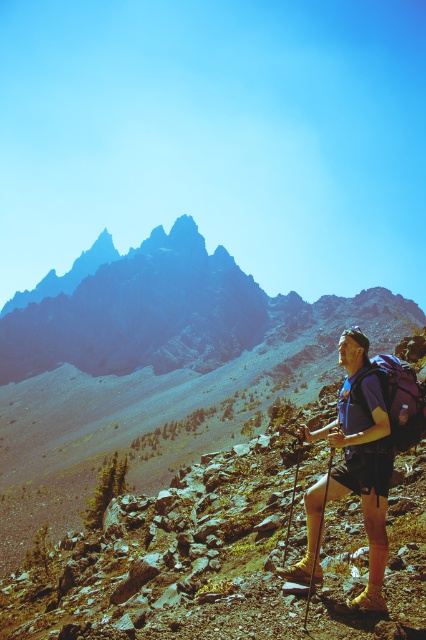
Question: Which point is closer to the camera?

Choices:
 (A) (350, 360)
 (B) (356, 397)

Answer: (B)

Question: Which object is positioned farthest from the purple matte backpack at center-right?

Choices:
 (A) matte blue shirt at center
 (B) rocky gray mountain at upper left

Answer: (B)

Question: Which object appears closest to the camera in this image?

Choices:
 (A) matte blue shirt at center
 (B) rocky gray mountain at upper left
 (C) purple matte backpack at center-right

Answer: (A)

Question: Can you confirm if matte blue shirt at center is positioned below purple matte backpack at center-right?

Choices:
 (A) yes
 (B) no

Answer: (A)

Question: Can you confirm if matte blue shirt at center is positioned to the right of purple matte backpack at center-right?

Choices:
 (A) yes
 (B) no

Answer: (A)

Question: Can you confirm if rocky gray mountain at upper left is smaller than matte blue shirt at center?

Choices:
 (A) no
 (B) yes

Answer: (A)